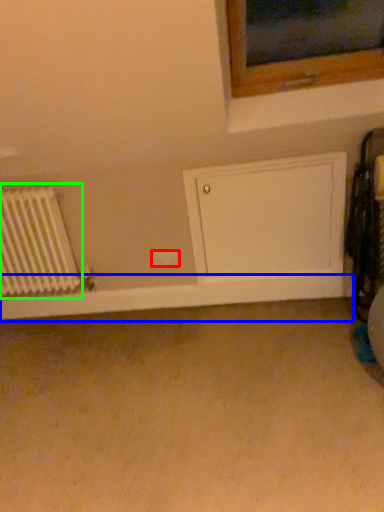
Question: Considering the real-world distances, which object is closest to electric outlet (highlighted by a red box)? window sill (highlighted by a blue box) or radiator (highlighted by a green box).

Choices:
 (A) window sill
 (B) radiator

Answer: (A)